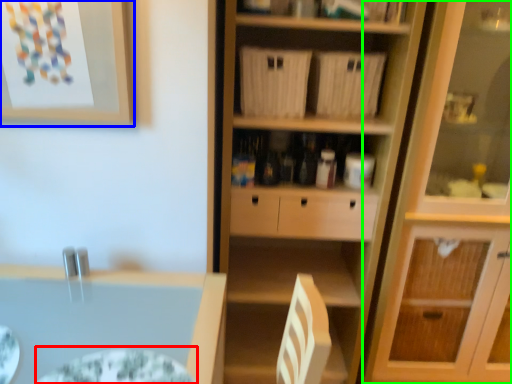
Question: Based on their relative distances, which object is nearer to glass plate (highlighted by a red box)? Choose from picture frame (highlighted by a blue box) and cabinetry (highlighted by a green box).

Choices:
 (A) picture frame
 (B) cabinetry

Answer: (A)